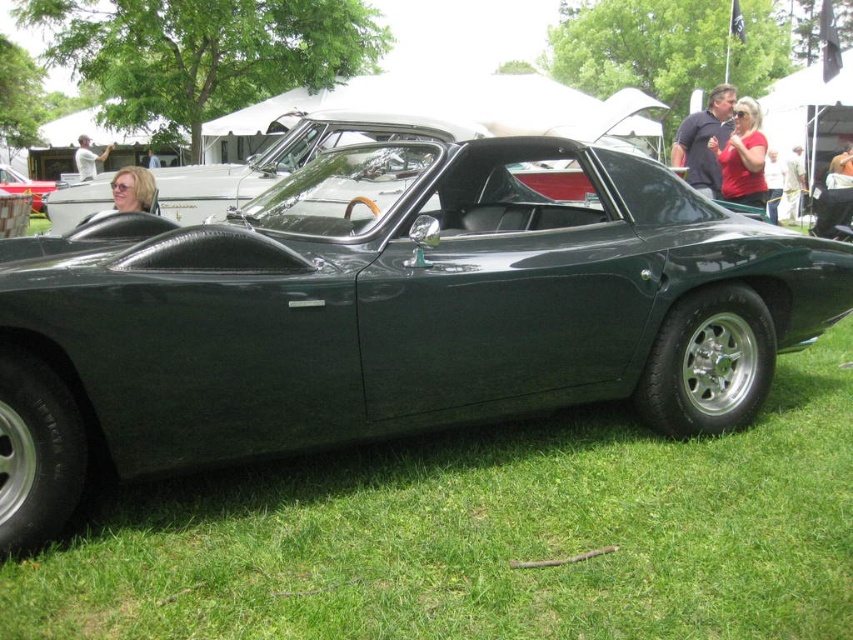
You are a photographer at the car show and want to capture both the denim pants at center and the light brown leather jacket at center in your shot. Since you need to focus on the larger object first, which one should you adjust your camera settings for first?

The denim pants at center is bigger than the light brown leather jacket at center, so you should adjust your camera settings for the denim pants at center first.